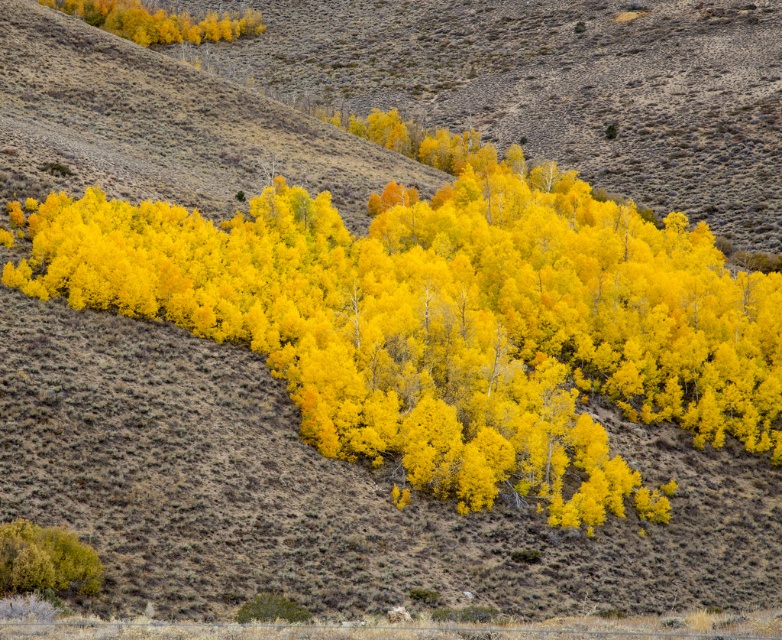
Question: Which of the following is the closest to the observer?

Choices:
 (A) green leafy bush at lower left
 (B) golden yellow leaves at upper left
 (C) yellow leafy trees at center

Answer: (A)

Question: Can you confirm if yellow leafy trees at center is smaller than golden yellow leaves at upper left?

Choices:
 (A) yes
 (B) no

Answer: (B)

Question: Which point is farther from the camera taking this photo?

Choices:
 (A) (633, 321)
 (B) (45, 540)

Answer: (A)

Question: Can you confirm if yellow leafy trees at center is positioned below golden yellow leaves at upper left?

Choices:
 (A) yes
 (B) no

Answer: (A)

Question: Which point appears farthest from the camera in this image?

Choices:
 (A) (0, 577)
 (B) (334, 305)
 (C) (59, 8)

Answer: (C)

Question: Is yellow leafy trees at center smaller than golden yellow leaves at upper left?

Choices:
 (A) no
 (B) yes

Answer: (A)